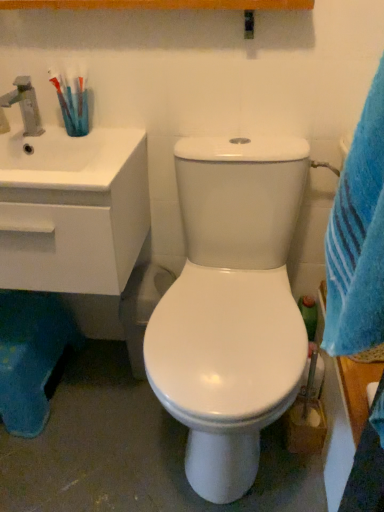
Question: Considering the positions of matte silver faucet at upper left and blue plush rug at lower left in the image, is matte silver faucet at upper left taller or shorter than blue plush rug at lower left?

Choices:
 (A) short
 (B) tall

Answer: (A)

Question: From the image's perspective, is matte silver faucet at upper left above or below blue plush rug at lower left?

Choices:
 (A) above
 (B) below

Answer: (A)

Question: Considering the real-world distances, which object is farthest from the white glossy sink at left?

Choices:
 (A) matte silver faucet at upper left
 (B) translucent plastic toothbrush at upper left
 (C) blue plush rug at lower left

Answer: (C)

Question: Which is nearer to the white glossy sink at left?

Choices:
 (A) matte silver faucet at upper left
 (B) translucent plastic toothbrush at upper left
 (C) blue plush rug at lower left

Answer: (B)